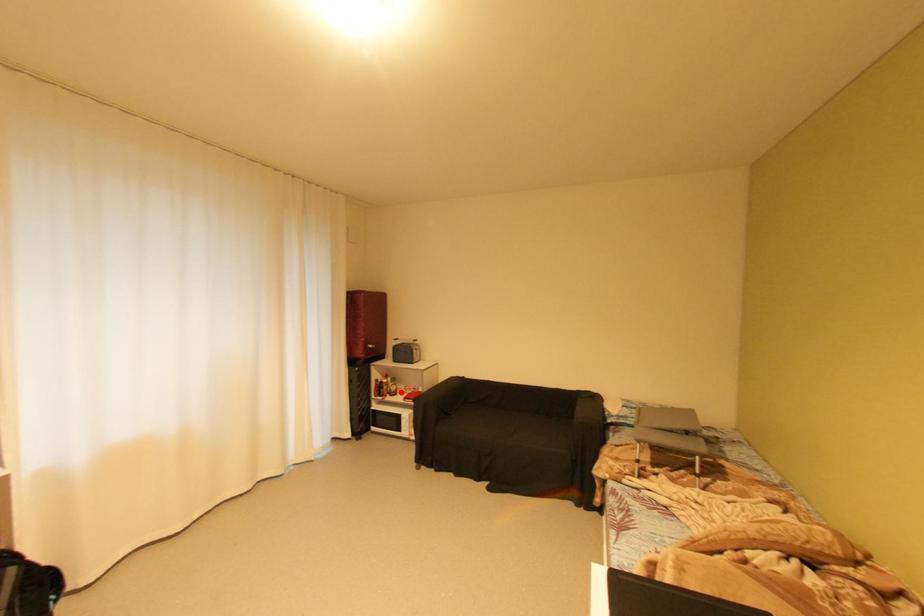
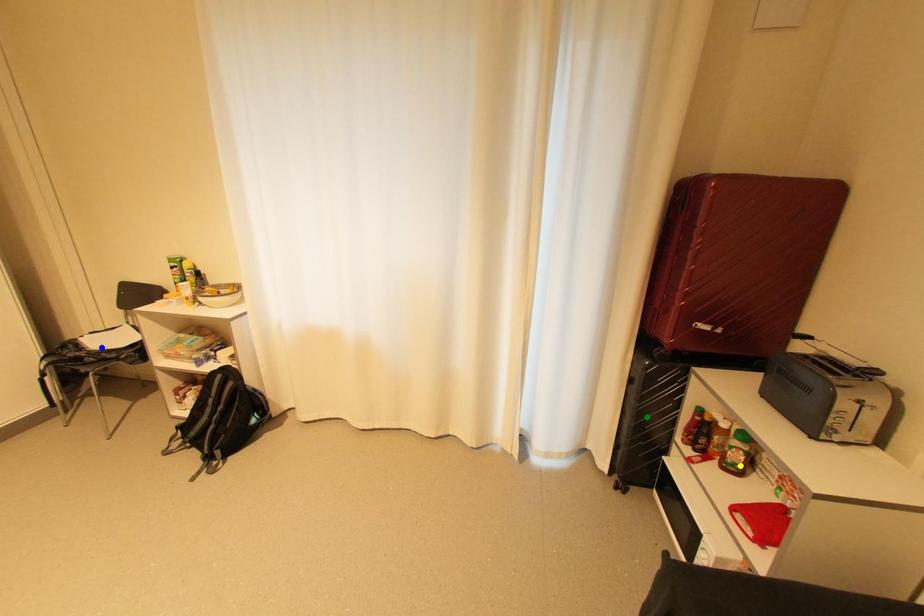
Question: I am providing you with two images of the same scene from different viewpoints. A red point is marked on the first image. You are given multiple points on the second image. In image 2, which mark is for the same physical point as the one in image 1?

Choices:
 (A) blue point
 (B) yellow point
 (C) green point

Answer: (B)